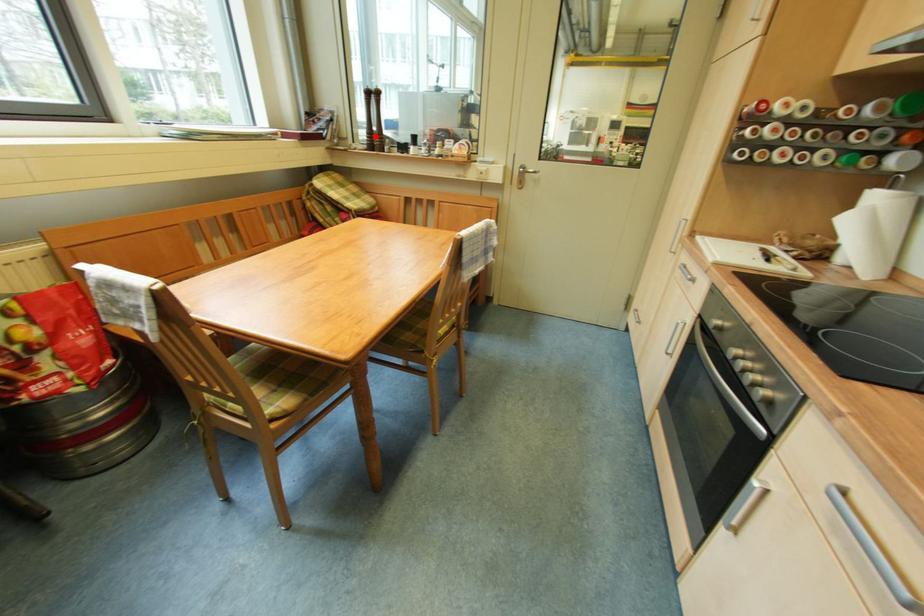
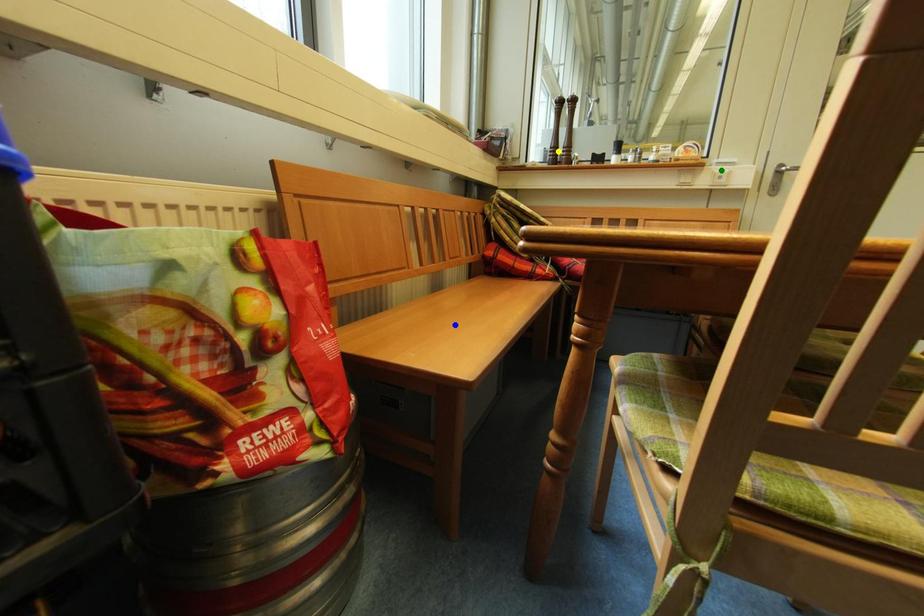
Question: I am providing you with two images of the same scene from different viewpoints. A red point is marked on the first image. You are given multiple points on the second image. Can you choose the point in image 2 that corresponds to the point in image 1?

Choices:
 (A) yellow point
 (B) green point
 (C) blue point

Answer: (A)